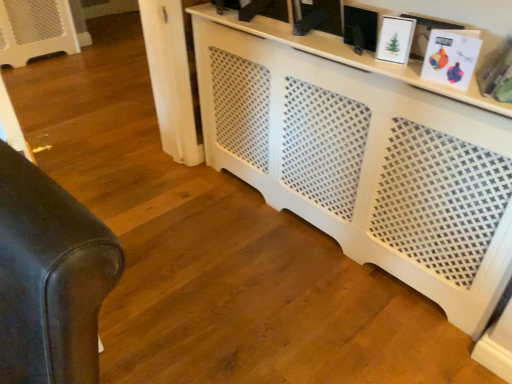
Image resolution: width=512 pixels, height=384 pixels. In order to click on blank space above white perforated cabinet at center (from a real-world perspective) in this screenshot , I will do `click(332, 44)`.